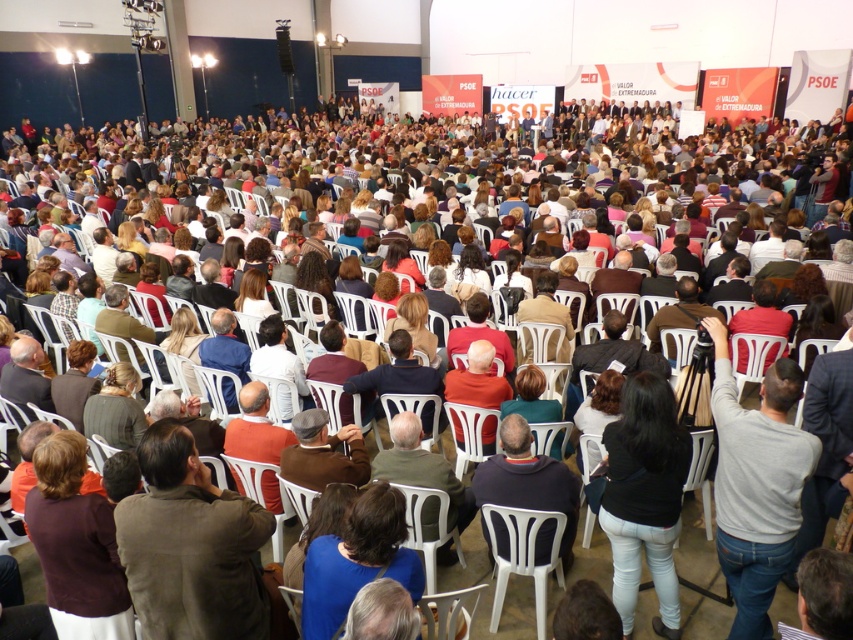
You are an event organizer who needs to ensure that all attendees have a clear view of the stage. You notice the gray cotton shirt at lower right and the blue fabric at center. Which of these two items might be obstructing the view of someone sitting behind them?

The gray cotton shirt at lower right has a larger size compared to blue fabric at center, so it is more likely to obstruct the view of someone sitting behind it.

You are attending a political rally and notice a brown sweater at lower left and a white plastic chair at center. Which object is covering the other?

The brown sweater at lower left is positioned over the white plastic chair at center, so the sweater is covering the chair.